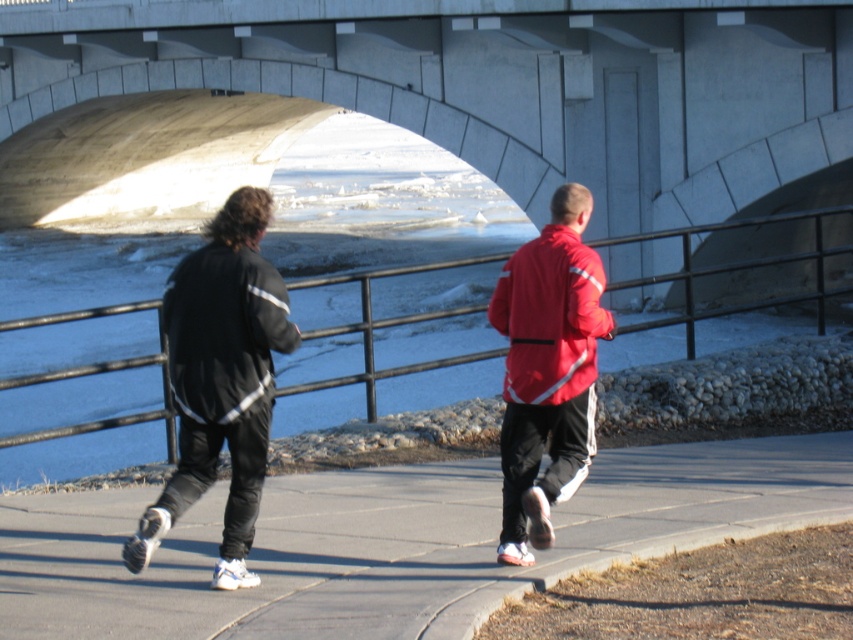
In the scene shown: You are a photographer standing on the path and want to take a photo of the smooth concrete pavement at center and the black smooth jacket at left. Which object should you focus on first if you want to capture both in sharp focus?

The smooth concrete pavement at center is in front of the black smooth jacket at left, so you should focus on the smooth concrete pavement at center first to ensure both are in sharp focus.

You are a drone operator trying to capture a photo of the matte black jacket at center. The drone is currently at a position above the bridge. To ensure the jacket is in the frame, which direction should you move the drone horizontally?

The matte black jacket at center is located at point (548, 369), so you should move the drone to align its camera towards that coordinate to capture the jacket in the frame.